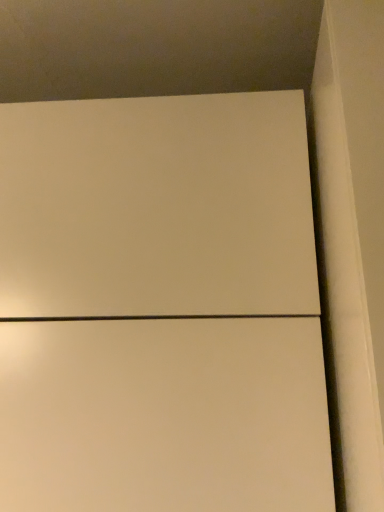
Question: Should I look upward or downward to see matte white cabinet at center?

Choices:
 (A) down
 (B) up

Answer: (A)